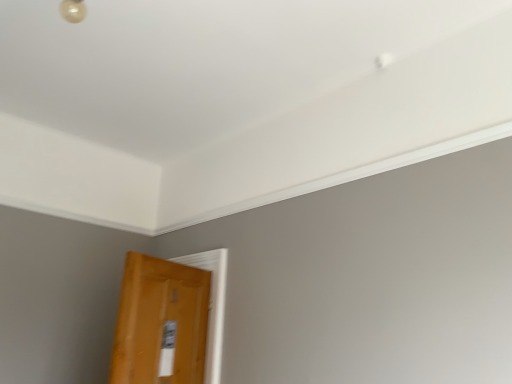
Locate an element on the screen. The width and height of the screenshot is (512, 384). wooden door at lower left is located at coordinates (161, 323).

The image size is (512, 384). What do you see at coordinates (161, 323) in the screenshot? I see `wooden door at lower left` at bounding box center [161, 323].

Where is `wooden door at lower left`? This screenshot has width=512, height=384. wooden door at lower left is located at coordinates (161, 323).